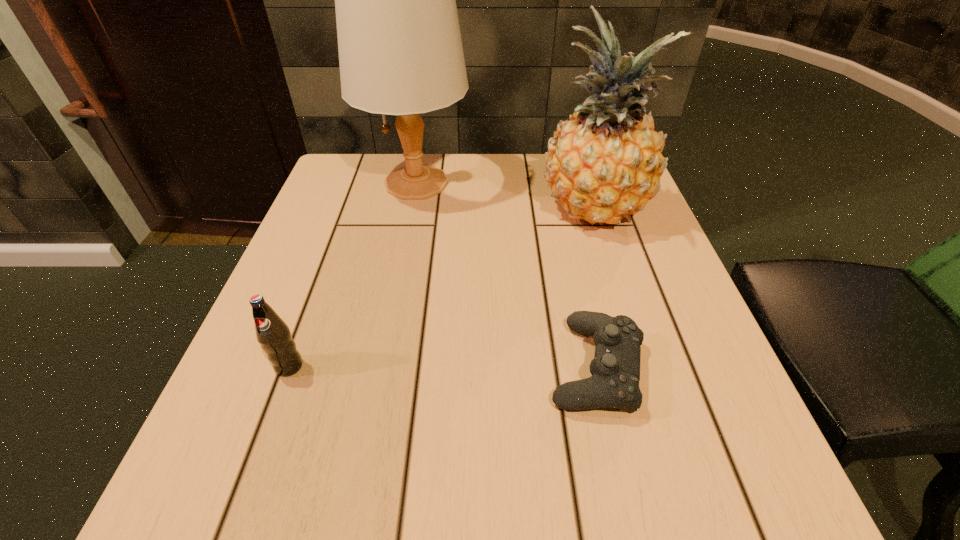
At what (x,y) coordinates should I click in order to perform the action: click on empty space between the control and the third tallest object. Please return your answer as a coordinate pair (x, y). Looking at the image, I should click on (443, 366).

Image resolution: width=960 pixels, height=540 pixels. Find the location of `free space between the third tallest object and the table lamp`. free space between the third tallest object and the table lamp is located at coordinates (352, 274).

This screenshot has height=540, width=960. What are the coordinates of `the third closest object to the pop` in the screenshot? It's located at (604, 162).

Identify the location of the closest object to the table lamp. Image resolution: width=960 pixels, height=540 pixels. (604, 162).

Where is `free location that satisfies the following two spatial constraints: 1. on the front side of the table lamp; 2. on the left side of the pineapple`? Image resolution: width=960 pixels, height=540 pixels. free location that satisfies the following two spatial constraints: 1. on the front side of the table lamp; 2. on the left side of the pineapple is located at coordinates (411, 210).